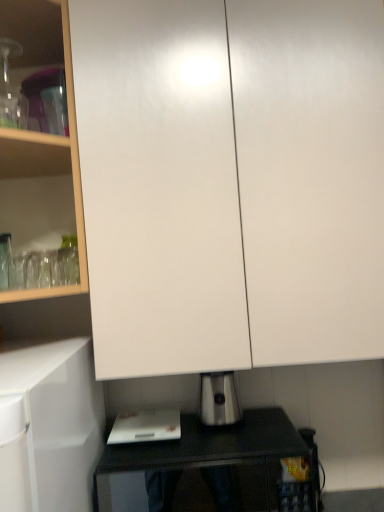
Question: Considering the relative sizes of white plastic cutting board at lower center and white glossy cabinet at upper left in the image provided, is white plastic cutting board at lower center bigger than white glossy cabinet at upper left?

Choices:
 (A) yes
 (B) no

Answer: (B)

Question: Is white glossy cabinet at upper left at the back of white plastic cutting board at lower center?

Choices:
 (A) yes
 (B) no

Answer: (B)

Question: Is white glossy cabinet at upper left completely or partially inside white plastic cutting board at lower center?

Choices:
 (A) no
 (B) yes

Answer: (A)

Question: From a real-world perspective, is white plastic cutting board at lower center on white glossy cabinet at upper left?

Choices:
 (A) yes
 (B) no

Answer: (B)

Question: Is white plastic cutting board at lower center further to the viewer compared to white glossy cabinet at upper left?

Choices:
 (A) no
 (B) yes

Answer: (B)

Question: Can we say white plastic cutting board at lower center lies outside white glossy cabinet at upper left?

Choices:
 (A) no
 (B) yes

Answer: (B)

Question: Is satin silver toaster at lower center positioned far away from black glossy table at lower center?

Choices:
 (A) yes
 (B) no

Answer: (B)

Question: Can you confirm if satin silver toaster at lower center is thinner than black glossy table at lower center?

Choices:
 (A) no
 (B) yes

Answer: (B)

Question: Does satin silver toaster at lower center touch black glossy table at lower center?

Choices:
 (A) yes
 (B) no

Answer: (B)

Question: Does satin silver toaster at lower center have a greater width compared to black glossy table at lower center?

Choices:
 (A) yes
 (B) no

Answer: (B)

Question: Is satin silver toaster at lower center to the left of black glossy table at lower center from the viewer's perspective?

Choices:
 (A) no
 (B) yes

Answer: (A)

Question: Is satin silver toaster at lower center at the right side of black glossy table at lower center?

Choices:
 (A) yes
 (B) no

Answer: (A)

Question: Is white plastic cutting board at lower center at the right side of black glossy table at lower center?

Choices:
 (A) no
 (B) yes

Answer: (A)